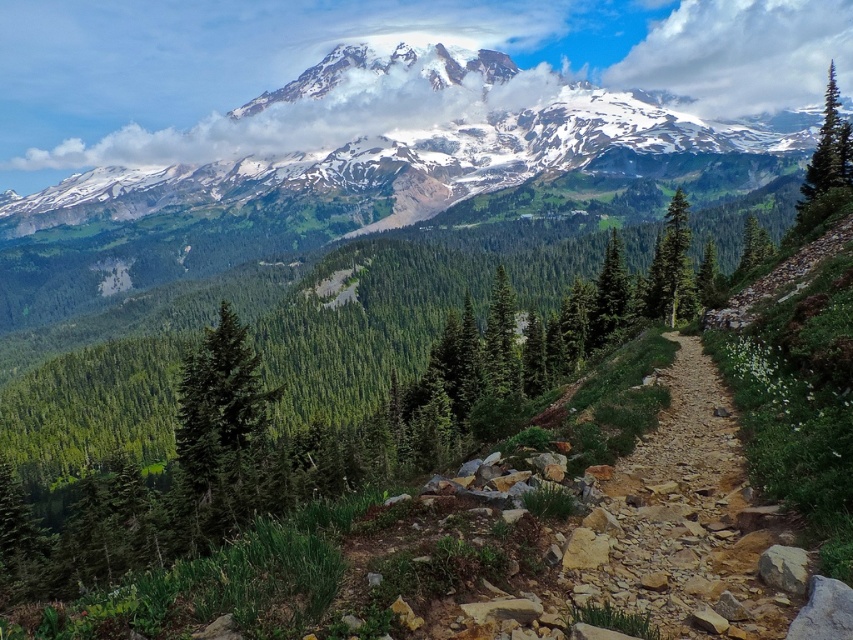
You are a hiker planning to take a photo of the snowy granite mountain range at upper center and the green textured tree at right. Which object should you focus on first if you want both to be in sharp focus?

The snowy granite mountain range at upper center is positioned on the left side of green textured tree at right, so you should focus on the snowy granite mountain range at upper center first to ensure both are in sharp focus.